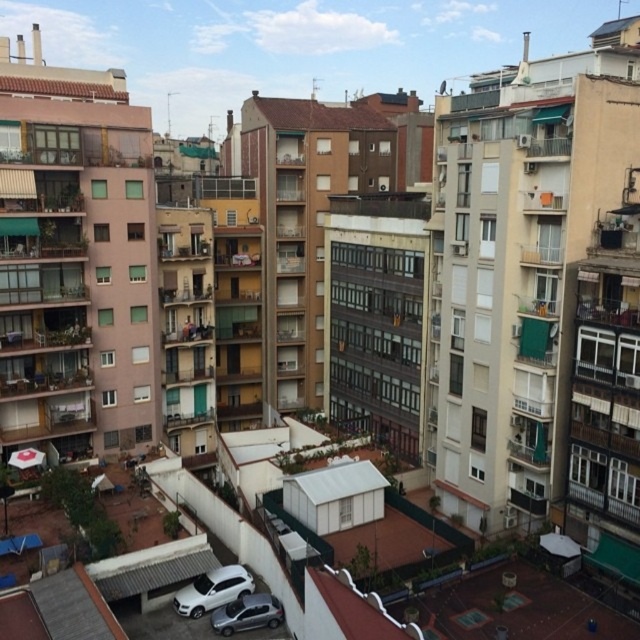
You are a delivery driver who needs to park your vehicle between the white matte suv at center and the satin silver car at lower center. The parking spot between them can accommodate vehicles up to 5 feet in length. Can your 5.5 feet long delivery van fit in this space?

The white matte suv at center is 5.60 feet away from the satin silver car at lower center. Since the parking space is 5.60 feet wide and the delivery van is 5.5 feet long, it can fit within the available space.

You are a delivery driver who needs to park your vehicle in a tight urban space. You see a white matte suv at center and a satin silver car at lower center. Which vehicle should you avoid parking next to if you need more space?

You should avoid parking next to the white matte suv at center because it is larger than the satin silver car at lower center, requiring more space.

You are a delivery person who needs to park your vehicle in a low clearance garage. The garage has a height restriction of 1.8 meters. You have two options to choose from the image, the white matte suv at center and the satin silver car at lower center. Which vehicle should you choose to ensure it fits under the height restriction?

The satin silver car at lower center should be chosen because the white matte suv at center has a greater height compared to satin silver car at lower center, making the car more likely to fit under the 1.8 meter height restriction.